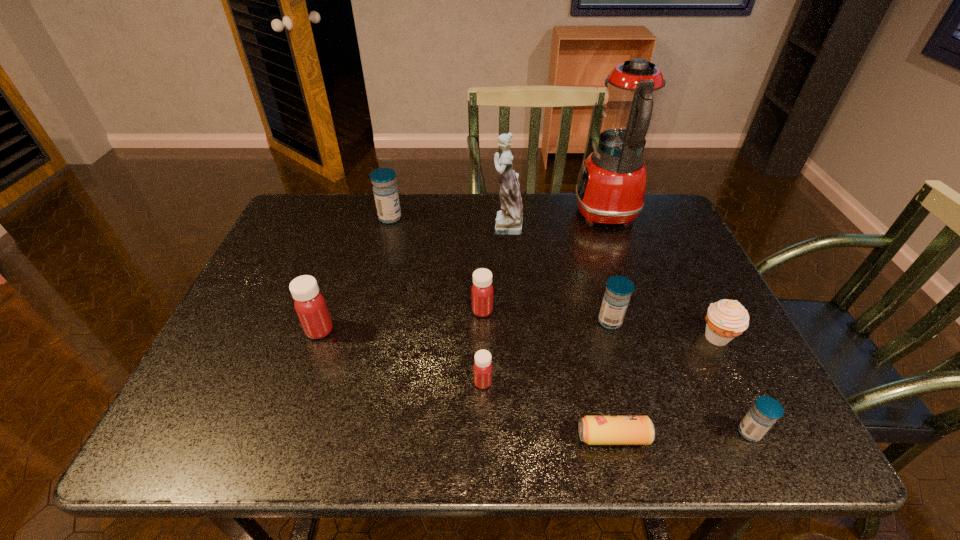
Where is `food processor`? Image resolution: width=960 pixels, height=540 pixels. food processor is located at coordinates (611, 187).

You are a GUI agent. You are given a task and a screenshot of the screen. Output one action in this format:
    pyautogui.click(x=<x>, y=<y>)
    Task: Click on the figurine
    The image size is (960, 540).
    Given the screenshot: What is the action you would take?
    pyautogui.click(x=509, y=221)

At what (x,y) coordinates should I click in order to perform the action: click on the farthest blue medicine. Please return your answer as a coordinate pair (x, y). Looking at the image, I should click on (385, 190).

Find the location of `the second medicine from left to right`. the second medicine from left to right is located at coordinates (385, 190).

Where is `the leftmost medicine`? the leftmost medicine is located at coordinates (310, 305).

Image resolution: width=960 pixels, height=540 pixels. In order to click on the second farthest red medicine in this screenshot , I will do `click(310, 305)`.

The width and height of the screenshot is (960, 540). I want to click on the fifth medicine from left to right, so click(616, 298).

Find the location of a particular element. The image size is (960, 540). the second biggest blue medicine is located at coordinates point(616,298).

At what (x,y) coordinates should I click in order to perform the action: click on the farthest red medicine. Please return your answer as a coordinate pair (x, y). The width and height of the screenshot is (960, 540). Looking at the image, I should click on (482, 290).

This screenshot has height=540, width=960. What are the coordinates of `muffin` in the screenshot? It's located at (726, 319).